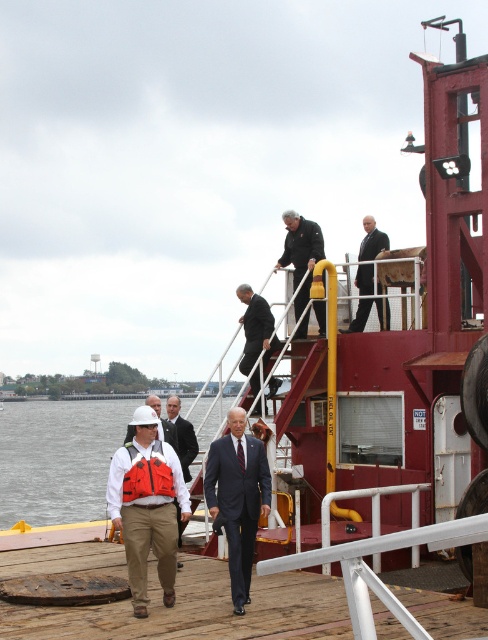
Question: Among these points, which one is nearest to the camera?

Choices:
 (A) (175, 397)
 (B) (166, 499)

Answer: (B)

Question: Is clear water at lower left bigger than white matte hard hat at center?

Choices:
 (A) no
 (B) yes

Answer: (B)

Question: Considering the relative positions of brown wooden deck at lower center and dark gray suit at upper center in the image provided, where is brown wooden deck at lower center located with respect to dark gray suit at upper center?

Choices:
 (A) right
 (B) left

Answer: (B)

Question: Which of the following is the closest to the observer?

Choices:
 (A) (273, 339)
 (B) (267, 502)
 (C) (303, 228)
 (D) (176, 400)

Answer: (B)

Question: Considering the real-world distances, which object is farthest from the white matte hard hat at center?

Choices:
 (A) dark gray uniform at upper center
 (B) dark blue suit at center

Answer: (A)

Question: Can you confirm if clear water at lower left is thinner than dark gray suit at upper center?

Choices:
 (A) yes
 (B) no

Answer: (B)